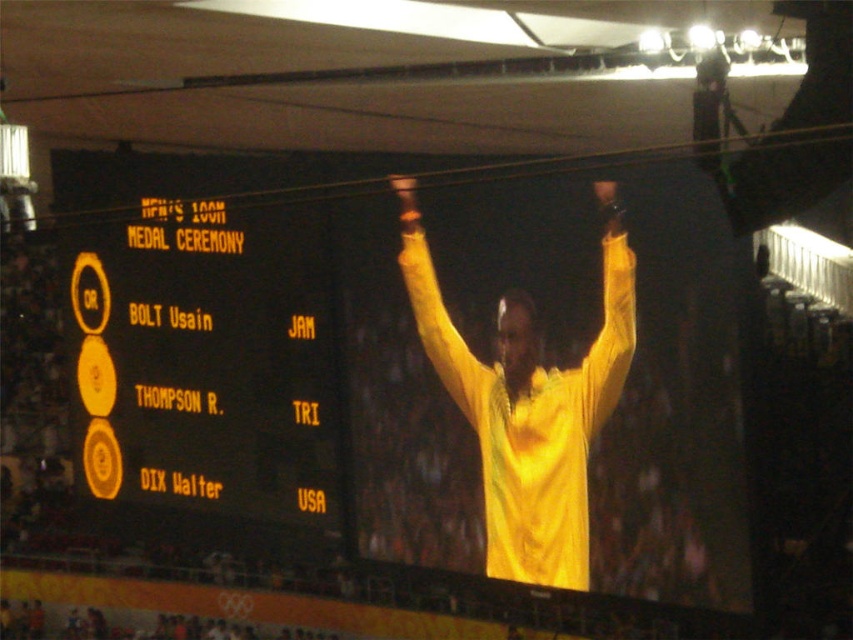
Question: Which point appears closest to the camera in this image?

Choices:
 (A) (233, 420)
 (B) (502, 416)

Answer: (B)

Question: Can you confirm if yellow fabric arm at center is bigger than yellow fabric arm at upper center?

Choices:
 (A) no
 (B) yes

Answer: (A)

Question: Based on their relative distances, which object is nearer to the yellow fabric arm at upper center?

Choices:
 (A) yellow matte scoreboard at upper center
 (B) yellow fabric arm at center

Answer: (B)

Question: Which object is positioned farthest from the yellow fabric arm at center?

Choices:
 (A) yellow matte scoreboard at upper center
 (B) yellow fabric at center

Answer: (A)

Question: Does yellow fabric at center lie in front of yellow fabric arm at upper center?

Choices:
 (A) yes
 (B) no

Answer: (B)

Question: Does yellow matte scoreboard at upper center appear under yellow fabric arm at upper center?

Choices:
 (A) no
 (B) yes

Answer: (B)